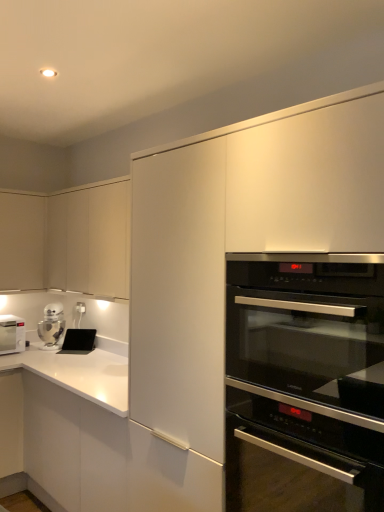
Question: Looking at the image, does white plastic electric outlet at upper left seem bigger or smaller compared to matte white cabinet at upper left, the second cabinetry in the left-to-right sequence?

Choices:
 (A) small
 (B) big

Answer: (A)

Question: Considering the positions of white plastic electric outlet at upper left and matte white cabinet at upper left, arranged as the 1th cabinetry when viewed from the right, in the image, is white plastic electric outlet at upper left taller or shorter than matte white cabinet at upper left, arranged as the 1th cabinetry when viewed from the right,?

Choices:
 (A) tall
 (B) short

Answer: (B)

Question: Estimate the real-world distances between objects in this image. Which object is farther from the silver metallic robot at lower left?

Choices:
 (A) matte white cabinet at upper left, arranged as the second cabinetry when viewed from the right
 (B) black glass oven at center right
 (C) white plastic electric outlet at upper left
 (D) black matte tablet at lower left
 (E) matte white cabinet at upper left, the second cabinetry in the left-to-right sequence

Answer: (B)

Question: Based on their relative distances, which object is nearer to the black matte tablet at lower left?

Choices:
 (A) matte white cabinet at upper left, positioned as the 1th cabinetry in left-to-right order
 (B) matte white cabinet at upper left, arranged as the 1th cabinetry when viewed from the right
 (C) black glass oven at center right
 (D) white matte microwave at left
 (E) silver metallic robot at lower left

Answer: (E)